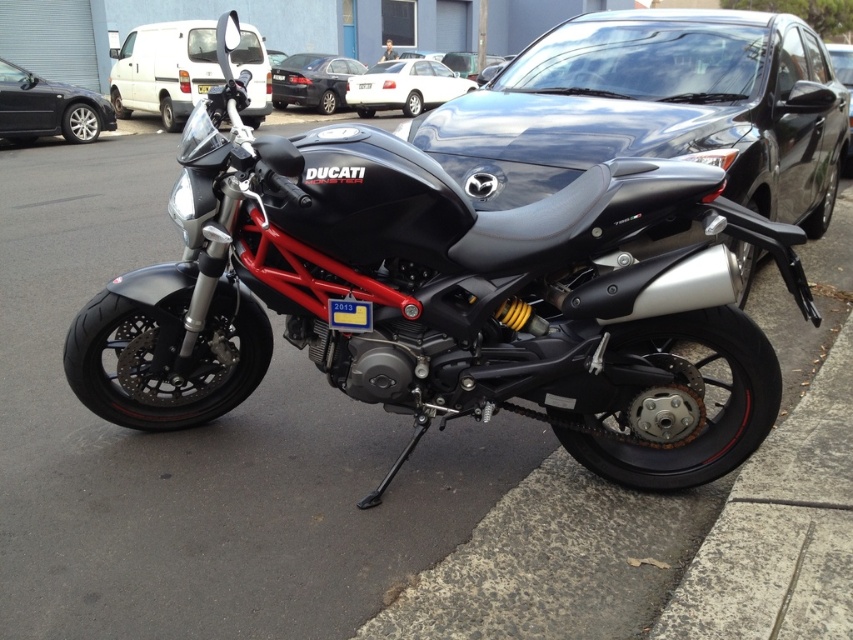
You are a delivery person trying to park a delivery van that requires a space of at least 5 meters in length. You observe the white glossy sedan at center and the silver metallic sedan at center in the parking lot. Based on their sizes, which one would require a longer parking space?

The white glossy sedan at center has a larger size compared to the silver metallic sedan at center, so it would require a longer parking space.

You are standing at the point closest to the Mazda CX5 SUV. Which coordinate point, either point (157, 76) or point (10, 93), is farther away from you?

Point (157, 76) is farther away from you because it is behind point (10, 93).